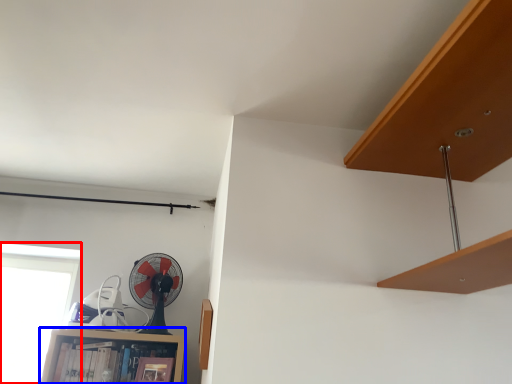
Question: Among these objects, which one is nearest to the camera, window (highlighted by a red box) or cabinet (highlighted by a blue box)?

Choices:
 (A) window
 (B) cabinet

Answer: (B)